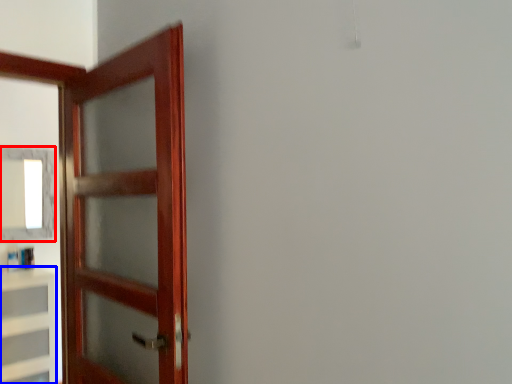
Question: Which point is further to the camera, mirror (highlighted by a red box) or cabinetry (highlighted by a blue box)?

Choices:
 (A) mirror
 (B) cabinetry

Answer: (A)